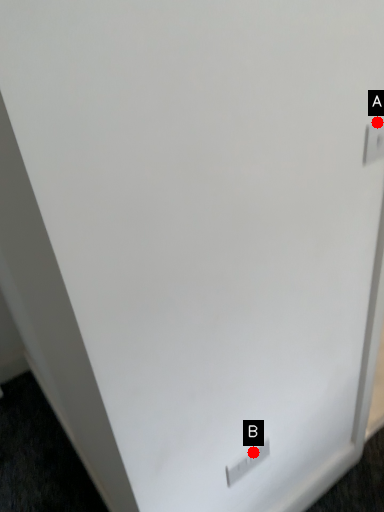
Question: Two points are circled on the image, labeled by A and B beside each circle. Among these points, which one is farthest from the camera?

Choices:
 (A) A is further
 (B) B is further

Answer: (B)